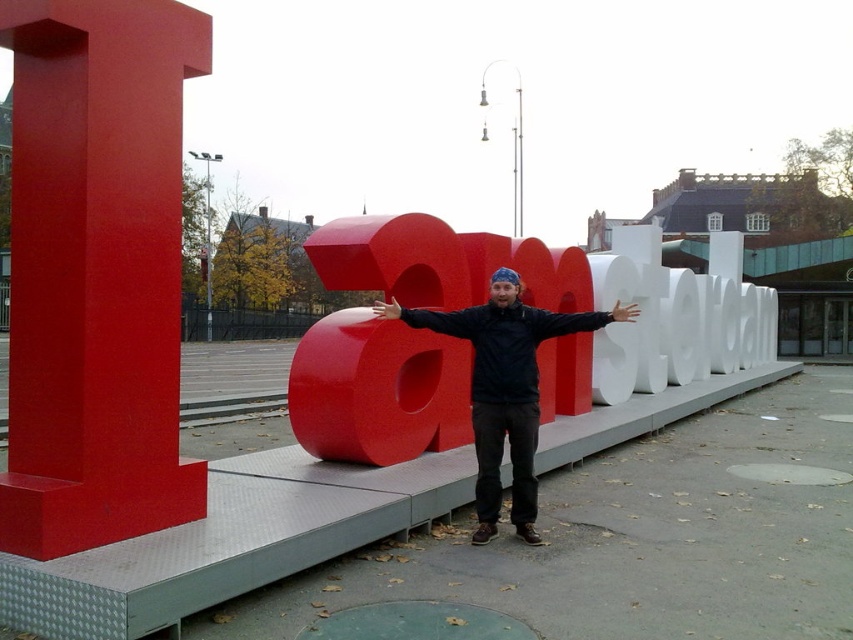
Question: Which object is the closest to the matte black arm at center?

Choices:
 (A) smooth skin hand at center
 (B) dark blue jacket at center
 (C) matte red hand at center
 (D) black matte arm at center

Answer: (C)

Question: Which point is closer to the camera?

Choices:
 (A) matte red hand at center
 (B) dark blue jacket at center
 (C) matte black arm at center

Answer: (C)

Question: Can you confirm if dark blue jacket at center is positioned to the right of black matte arm at center?

Choices:
 (A) yes
 (B) no

Answer: (B)

Question: Does black matte arm at center appear over matte black arm at center?

Choices:
 (A) yes
 (B) no

Answer: (B)

Question: Among these objects, which one is nearest to the camera?

Choices:
 (A) matte red hand at center
 (B) smooth skin hand at center
 (C) black matte arm at center

Answer: (B)

Question: Observing the image, what is the correct spatial positioning of dark blue jacket at center in reference to matte black arm at center?

Choices:
 (A) left
 (B) right

Answer: (B)